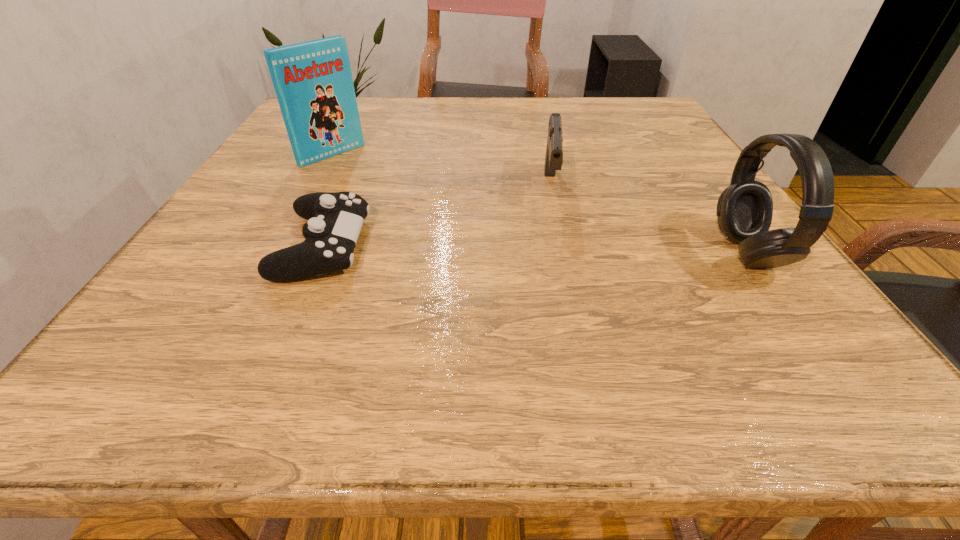
The image size is (960, 540). I want to click on vacant area located 0.060m on the front cover of the book, so click(x=362, y=174).

Where is `free space located on the front cover of the book`? The image size is (960, 540). free space located on the front cover of the book is located at coordinates (403, 202).

Where is `vacant space located 0.190m on the front cover of the book`? vacant space located 0.190m on the front cover of the book is located at coordinates (396, 198).

Image resolution: width=960 pixels, height=540 pixels. Find the location of `vacant region located aim along the barrel of the second object from right to left`. vacant region located aim along the barrel of the second object from right to left is located at coordinates (556, 269).

Identify the location of vacant area located 0.260m aim along the barrel of the second object from right to left. This screenshot has width=960, height=540. (557, 309).

Image resolution: width=960 pixels, height=540 pixels. What are the coordinates of `vacant area located aim along the barrel of the second object from right to left` in the screenshot? It's located at (557, 329).

I want to click on control that is at the near edge, so click(x=335, y=219).

Locate an element on the screen. headset that is positioned at the near edge is located at coordinates (744, 212).

The image size is (960, 540). What are the coordinates of `control that is at the left edge` in the screenshot? It's located at (335, 219).

Identify the location of book that is at the left edge. (313, 82).